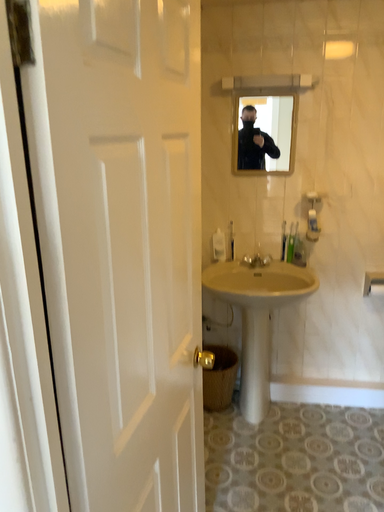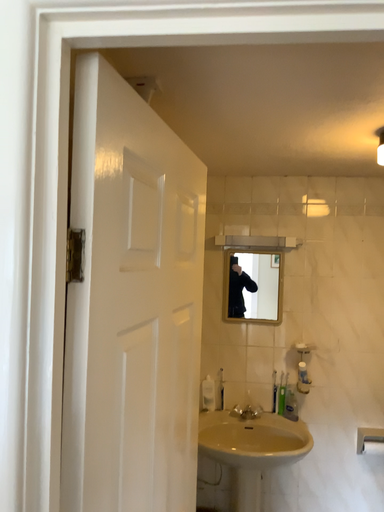
Question: How did the camera likely rotate when shooting the video?

Choices:
 (A) rotated upward
 (B) rotated downward

Answer: (A)